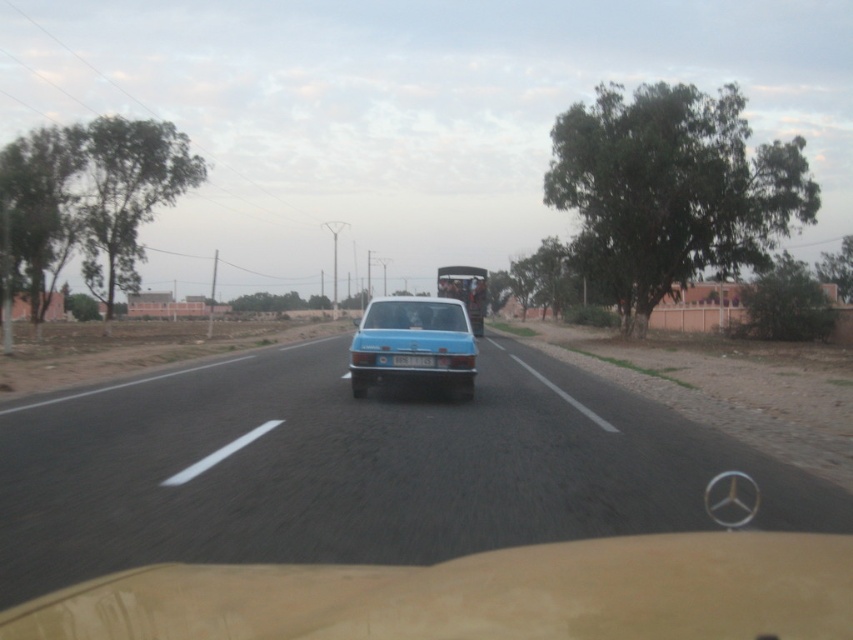
Question: Can you confirm if blue matte sedan at center is bigger than blue plastic license plate at center?

Choices:
 (A) yes
 (B) no

Answer: (A)

Question: Which point appears closest to the camera in this image?

Choices:
 (A) (451, 352)
 (B) (1, 508)
 (C) (397, 364)

Answer: (B)

Question: Is blue glossy car at center positioned behind blue plastic license plate at center?

Choices:
 (A) yes
 (B) no

Answer: (B)

Question: Among these objects, which one is farthest from the camera?

Choices:
 (A) blue glossy car at center
 (B) blue matte sedan at center

Answer: (B)

Question: Which object is farther from the camera taking this photo?

Choices:
 (A) blue matte sedan at center
 (B) blue plastic license plate at center

Answer: (A)

Question: Does blue matte sedan at center appear on the left side of blue plastic license plate at center?

Choices:
 (A) yes
 (B) no

Answer: (B)